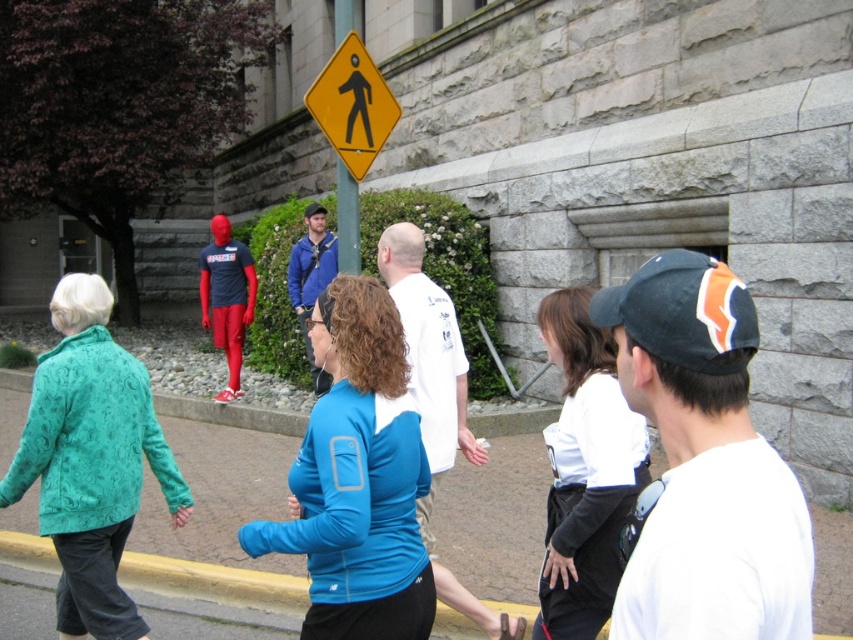
You are standing at the point with coordinates (x=91, y=460) in the image. What object are you currently standing on?

You are standing on the teal textured jacket at lower left.

You are a delivery person with a 3.5 meter long package. You need to place it between the blue fabric shirt at center and the blue fabric at center. Is there enough space?

Result: The distance between the blue fabric shirt at center and the blue fabric at center is 4.03 meters. Since the package is 3.5 meters long, there is enough space to place it between them.